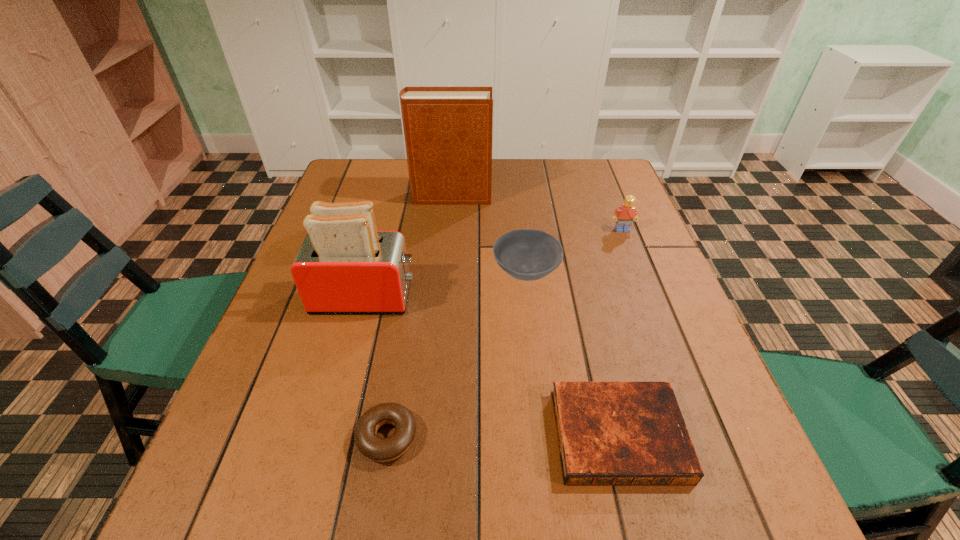
In the image, there is a desktop. Find the location of `free space at the far edge`. free space at the far edge is located at coordinates (550, 159).

Find the location of `free region at the left edge of the desktop`. free region at the left edge of the desktop is located at coordinates (364, 199).

You are a GUI agent. You are given a task and a screenshot of the screen. Output one action in this format:
    pyautogui.click(x=<x>, y=<y>)
    Task: Click on the vacant area at the right edge
    
    Given the screenshot: What is the action you would take?
    pyautogui.click(x=590, y=227)

Image resolution: width=960 pixels, height=540 pixels. In order to click on vacant space at the far left corner in this screenshot , I will do `click(384, 181)`.

The height and width of the screenshot is (540, 960). Find the location of `free space at the near left corner of the desktop`. free space at the near left corner of the desktop is located at coordinates (222, 516).

Image resolution: width=960 pixels, height=540 pixels. Find the location of `free space at the far right corner`. free space at the far right corner is located at coordinates pos(600,179).

Image resolution: width=960 pixels, height=540 pixels. What are the coordinates of `vacant space at the near right corner of the desktop` in the screenshot? It's located at (703, 481).

This screenshot has width=960, height=540. I want to click on free space that is in between the fifth shortest object and the Bible, so (x=492, y=366).

Locate an element on the screen. Image resolution: width=960 pixels, height=540 pixels. free point between the tallest object and the rightmost object is located at coordinates (537, 213).

At what (x,y) coordinates should I click in order to perform the action: click on empty space between the fourth tallest object and the Bible. Please return your answer as a coordinate pair (x, y). Looking at the image, I should click on (572, 354).